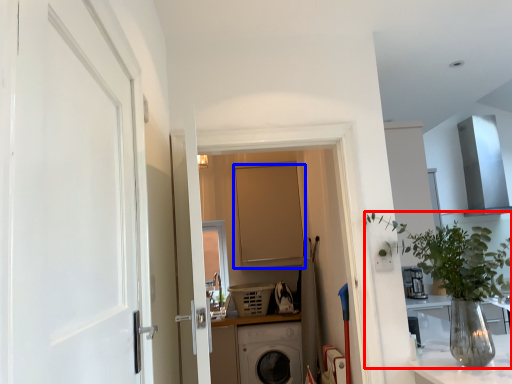
Question: Which of the following is the farthest to the observer, houseplant (highlighted by a red box) or door (highlighted by a blue box)?

Choices:
 (A) houseplant
 (B) door

Answer: (B)